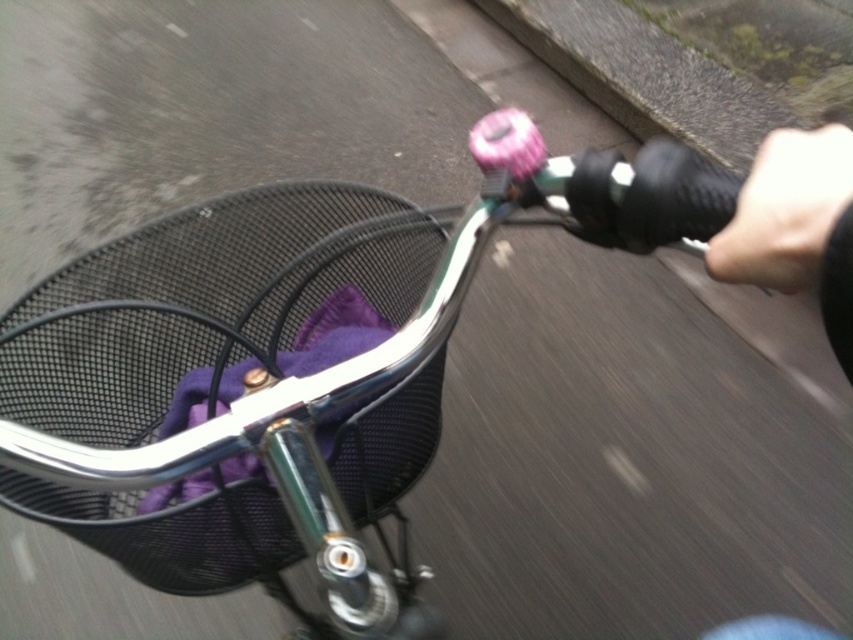
From the picture: You are riding a bicycle and want to place a small item in the black mesh basket at lower left. Based on its position, where should you look to locate it?

The black mesh basket at lower left is located at point coordinates (202, 300), so you should look towards the lower left direction to find it.

You are riding a bicycle and want to place a small item in the basket. The basket is located at point (202,300). Where should you look to ensure you can place the item correctly?

The point (202,300) marks the location of the black mesh basket at lower left, so you should look towards the black mesh basket at lower left to place the item correctly.

You are riding a bicycle and want to place a small item into the black mesh basket at lower left. To do so, you need to reach past the black leather handlebar grip at right. Is the basket below or above the handlebar grip?

The black mesh basket at lower left is below the black leather handlebar grip at right, so you can reach it by moving your hand downward past the grip.